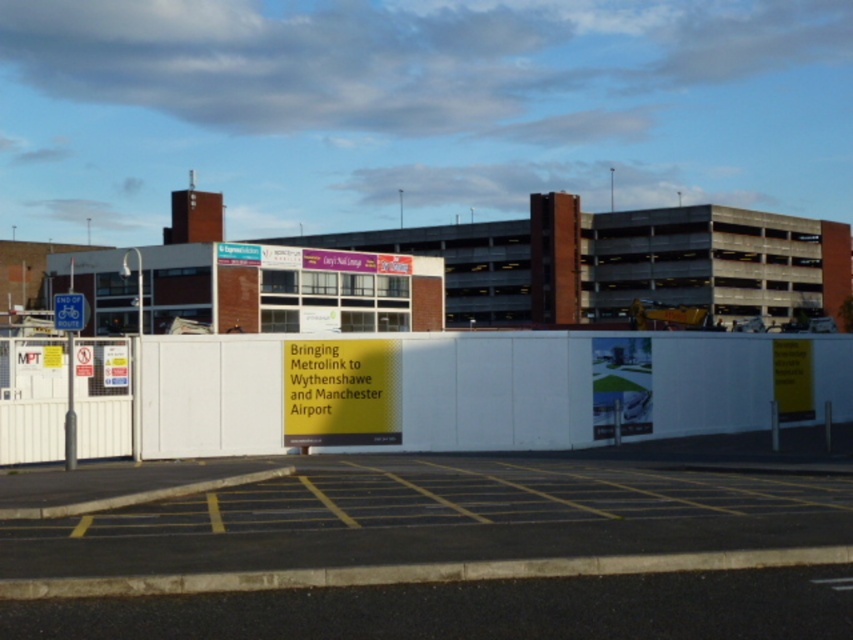
Does yellow asphalt parking lot at lower center have a greater width compared to white matte barrier at center?

Incorrect, yellow asphalt parking lot at lower center's width does not surpass white matte barrier at center's.

Can you confirm if yellow asphalt parking lot at lower center is smaller than white matte barrier at center?

Indeed, yellow asphalt parking lot at lower center has a smaller size compared to white matte barrier at center.

Identify the location of yellow asphalt parking lot at lower center. (453, 554).

Does yellow asphalt parking lot at lower center have a lesser width compared to blue plastic bicycle sign at left?

Incorrect, yellow asphalt parking lot at lower center's width is not less than blue plastic bicycle sign at left's.

Does yellow asphalt parking lot at lower center have a lesser height compared to blue plastic bicycle sign at left?

No, yellow asphalt parking lot at lower center is not shorter than blue plastic bicycle sign at left.

The width and height of the screenshot is (853, 640). In order to click on yellow asphalt parking lot at lower center in this screenshot , I will do click(x=453, y=554).

Is white matte barrier at center to the right of blue plastic bicycle sign at left from the viewer's perspective?

Correct, you'll find white matte barrier at center to the right of blue plastic bicycle sign at left.

Does white matte barrier at center appear on the left side of blue plastic bicycle sign at left?

No, white matte barrier at center is not to the left of blue plastic bicycle sign at left.

Who is more distant from viewer, (714, 342) or (57, 328)?

The point (714, 342) is more distant.

Find the location of a particular element. Image resolution: width=853 pixels, height=640 pixels. white matte barrier at center is located at coordinates (573, 388).